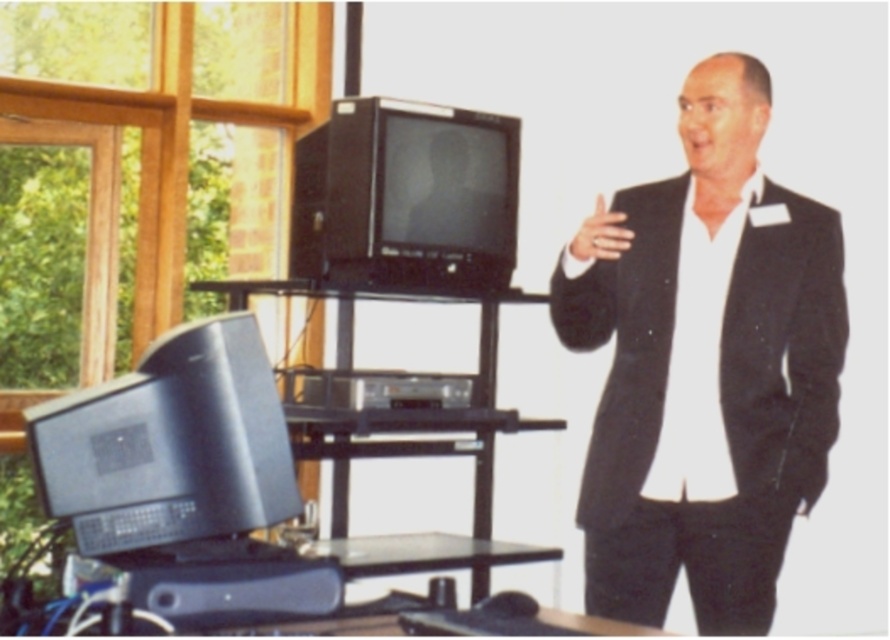
You are a photographer setting up for a photoshoot. You need to ensure that the black matte suit at right and the black plastic television at upper center are both visible in the frame. Based on their positions, which object will appear closer to the camera?

The black matte suit at right is in front of the black plastic television at upper center, so it will appear closer to the camera.